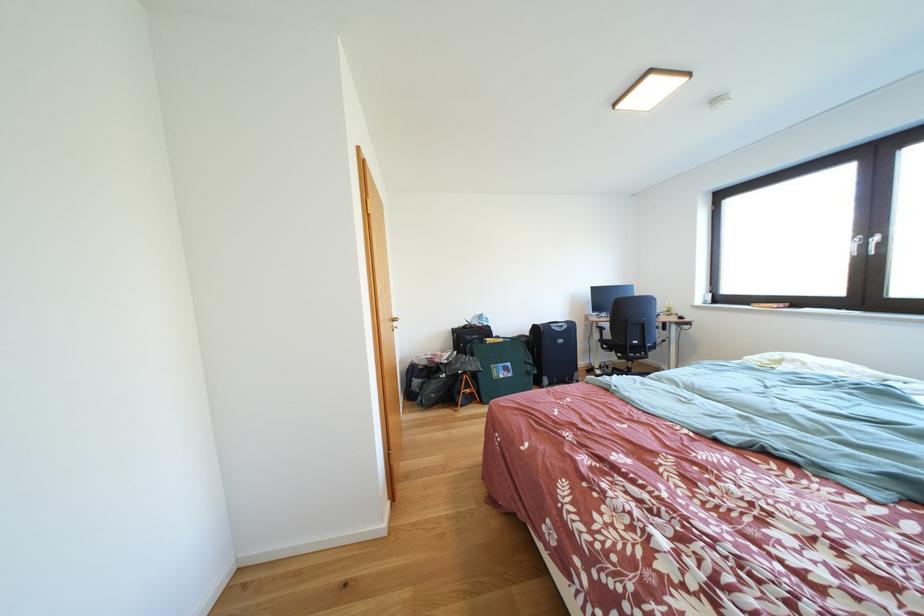
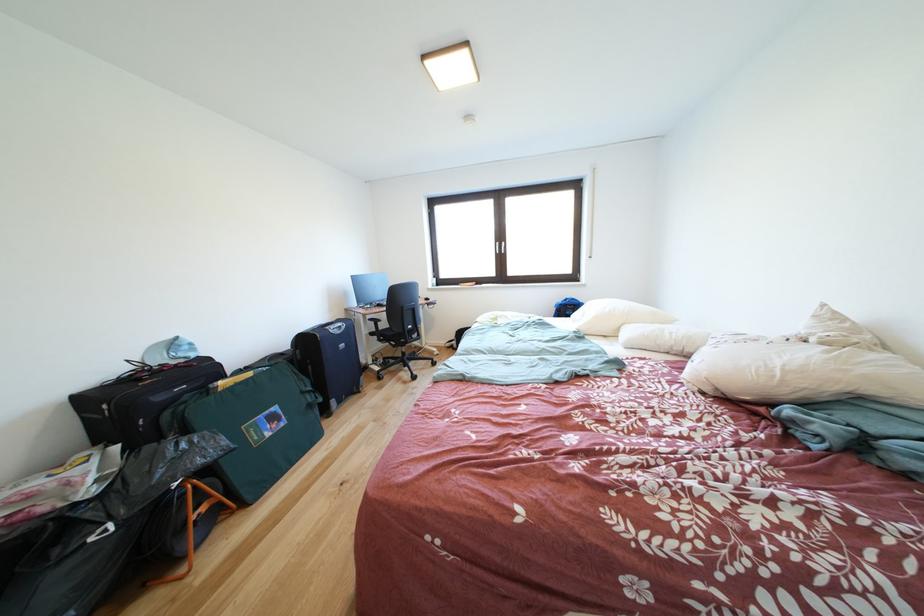
Where in the second image is the point corresponding to point 627,363 from the first image?

(403, 351)